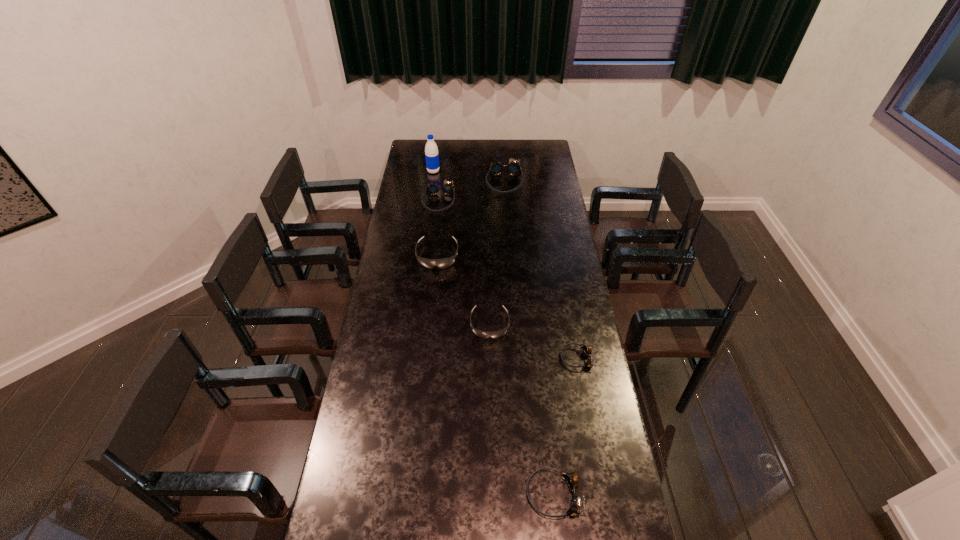
Find the location of a particular element. Image resolution: width=960 pixels, height=540 pixels. vacant area that lies between the bigger black goggles and the blue water bottle is located at coordinates (436, 213).

The height and width of the screenshot is (540, 960). Find the location of `free space that is in between the third farthest goggles and the right black goggles`. free space that is in between the third farthest goggles and the right black goggles is located at coordinates (464, 290).

This screenshot has width=960, height=540. Identify the location of vacant region between the bigger black goggles and the smaller black goggles. (464, 290).

Choose which object is the sixth nearest neighbor to the water bottle. Please provide its 2D coordinates. Your answer should be formatted as a tuple, i.e. [(x, y)], where the tuple contains the x and y coordinates of a point satisfying the conditions above.

[(571, 479)]

You are a GUI agent. You are given a task and a screenshot of the screen. Output one action in this format:
    pyautogui.click(x=<x>, y=<y>)
    Task: Click on the third closest object relative to the fifth farthest goggles
    
    Given the screenshot: What is the action you would take?
    pyautogui.click(x=443, y=263)

Select which goggles is the second closest to the tallest goggles. Please provide its 2D coordinates. Your answer should be formatted as a tuple, i.e. [(x, y)], where the tuple contains the x and y coordinates of a point satisfying the conditions above.

[(443, 263)]

Choose which goggles is the fourth nearest neighbor to the nearest bronze goggles. Please provide its 2D coordinates. Your answer should be formatted as a tuple, i.e. [(x, y)], where the tuple contains the x and y coordinates of a point satisfying the conditions above.

[(432, 189)]

You are a GUI agent. You are given a task and a screenshot of the screen. Output one action in this format:
    pyautogui.click(x=<x>, y=<y>)
    Task: Click on the fourth closest bronze goggles to the fourth nearest object
    The image size is (960, 540).
    Given the screenshot: What is the action you would take?
    pyautogui.click(x=571, y=479)

At what (x,y) coordinates should I click in order to perform the action: click on bronze goggles that is the third closest to the second nearest object. Please return your answer as a coordinate pair (x, y). This screenshot has height=540, width=960. Looking at the image, I should click on click(x=513, y=168).

Where is `the closest black goggles to the leftmost bronze goggles`? the closest black goggles to the leftmost bronze goggles is located at coordinates (443, 263).